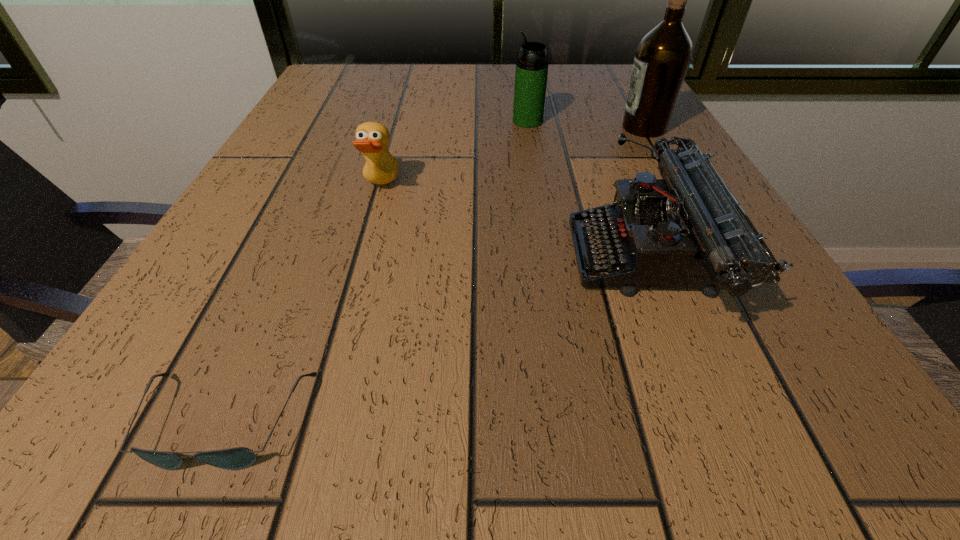
You are a GUI agent. You are given a task and a screenshot of the screen. Output one action in this format:
    pyautogui.click(x=<x>, y=<y>)
    Task: Click on the free space located from the spout of the fourth shortest object
    This screenshot has width=960, height=540.
    Given the screenshot: What is the action you would take?
    click(449, 121)

I want to click on free region located from the spout of the fourth shortest object, so click(356, 121).

This screenshot has height=540, width=960. What are the coordinates of `vacant space located on the keyboard of the typewriter` in the screenshot? It's located at (386, 259).

Where is `free location located on the keyboard of the typewriter`? The width and height of the screenshot is (960, 540). free location located on the keyboard of the typewriter is located at coordinates (458, 259).

Identify the location of vacant space located on the keyboard of the typewriter. (523, 259).

At what (x,y) coordinates should I click in order to perform the action: click on free space located on the beak of the duck. Please return your answer as a coordinate pair (x, y). This screenshot has height=540, width=960. Looking at the image, I should click on (441, 187).

This screenshot has width=960, height=540. Find the location of `object that is at the near edge`. object that is at the near edge is located at coordinates (237, 458).

Locate an element on the screen. The height and width of the screenshot is (540, 960). object that is positioned at the left edge is located at coordinates (237, 458).

Locate an element on the screen. This screenshot has width=960, height=540. olive oil present at the right edge is located at coordinates (663, 56).

Locate an element on the screen. The image size is (960, 540). typewriter that is at the right edge is located at coordinates (684, 231).